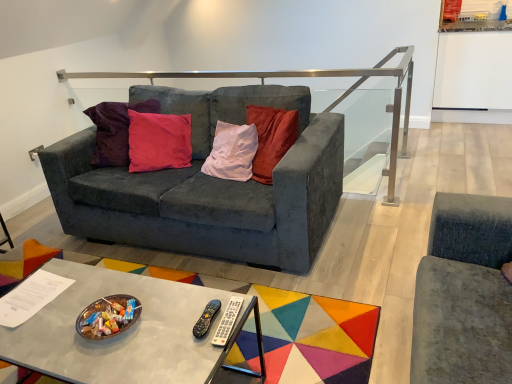
Question: Is silver plastic remote at center, arranged as the 1th remote when viewed from the right, positioned beyond the bounds of black plastic remote at center, positioned as the 2th remote in right-to-left order?

Choices:
 (A) yes
 (B) no

Answer: (A)

Question: Is silver plastic remote at center, the 2th remote when ordered from left to right, positioned with its back to black plastic remote at center, positioned as the 2th remote in right-to-left order?

Choices:
 (A) no
 (B) yes

Answer: (A)

Question: Is silver plastic remote at center, arranged as the 1th remote when viewed from the right, bigger than black plastic remote at center, which is the 1th remote from left to right?

Choices:
 (A) yes
 (B) no

Answer: (B)

Question: Is silver plastic remote at center, arranged as the 1th remote when viewed from the right, positioned far away from black plastic remote at center, positioned as the 2th remote in right-to-left order?

Choices:
 (A) no
 (B) yes

Answer: (A)

Question: Can you confirm if silver plastic remote at center, arranged as the 1th remote when viewed from the right, is wider than black plastic remote at center, positioned as the 2th remote in right-to-left order?

Choices:
 (A) yes
 (B) no

Answer: (A)

Question: Does silver plastic remote at center, arranged as the 1th remote when viewed from the right, appear on the left side of black plastic remote at center, positioned as the 2th remote in right-to-left order?

Choices:
 (A) no
 (B) yes

Answer: (A)

Question: Is black plastic remote at center, positioned as the 2th remote in right-to-left order, taller than metallic gray coffee table at center?

Choices:
 (A) yes
 (B) no

Answer: (B)

Question: From a real-world perspective, is black plastic remote at center, positioned as the 2th remote in right-to-left order, positioned over metallic gray coffee table at center based on gravity?

Choices:
 (A) yes
 (B) no

Answer: (A)

Question: Can you confirm if black plastic remote at center, positioned as the 2th remote in right-to-left order, is positioned to the right of metallic gray coffee table at center?

Choices:
 (A) no
 (B) yes

Answer: (B)

Question: Can you confirm if black plastic remote at center, positioned as the 2th remote in right-to-left order, is smaller than metallic gray coffee table at center?

Choices:
 (A) yes
 (B) no

Answer: (A)

Question: Is black plastic remote at center, which is the 1th remote from left to right, wider than metallic gray coffee table at center?

Choices:
 (A) yes
 (B) no

Answer: (B)

Question: From the image's perspective, is black plastic remote at center, which is the 1th remote from left to right, on metallic gray coffee table at center?

Choices:
 (A) yes
 (B) no

Answer: (A)

Question: Is silver plastic remote at center, the 2th remote when ordered from left to right, aimed at velvet dark gray couch at center?

Choices:
 (A) yes
 (B) no

Answer: (A)